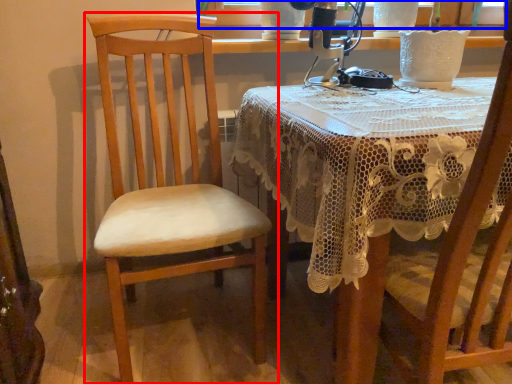
Question: Among these objects, which one is nearest to the camera, chair (highlighted by a red box) or window screen (highlighted by a blue box)?

Choices:
 (A) chair
 (B) window screen

Answer: (A)